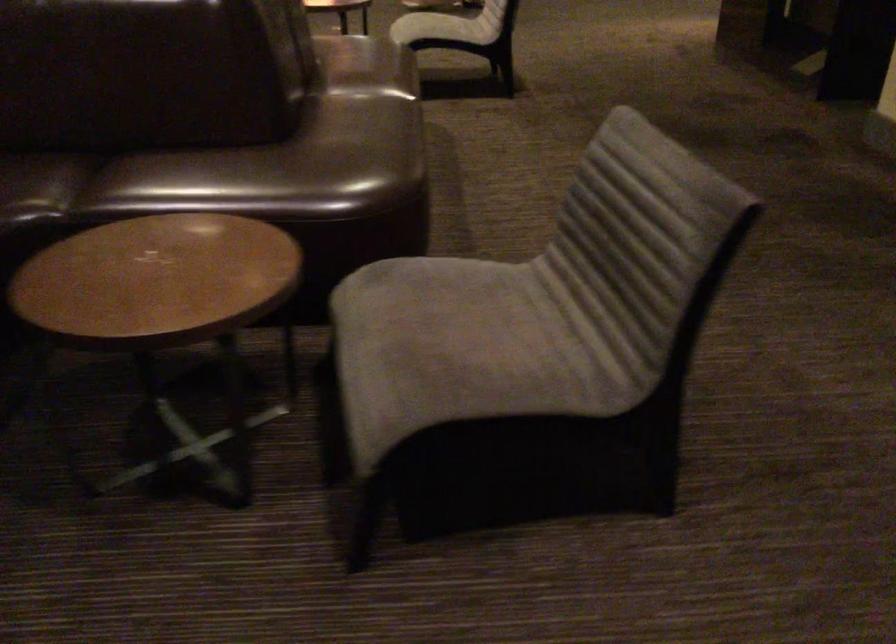
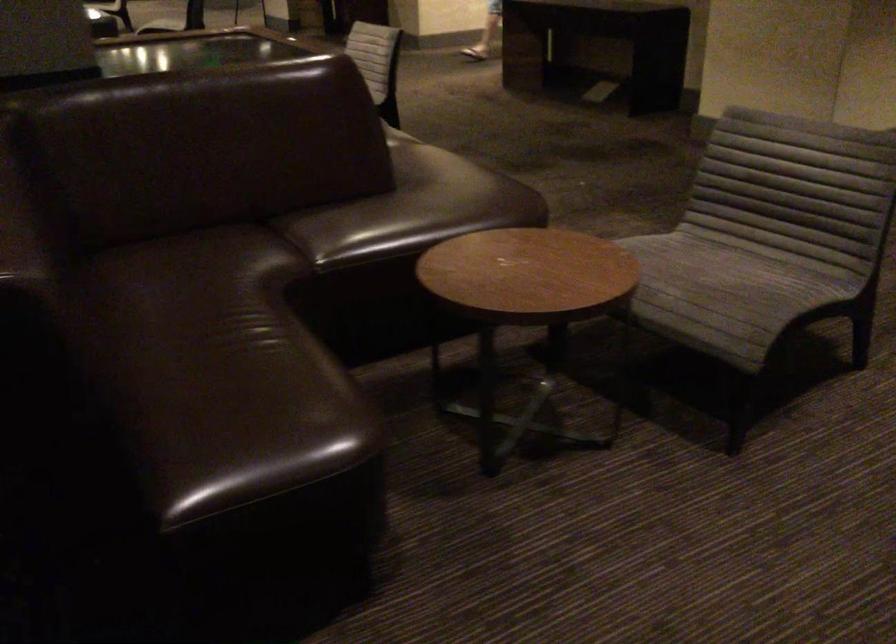
Find the pixel in the second image that matches [436,361] in the first image.

(722, 286)